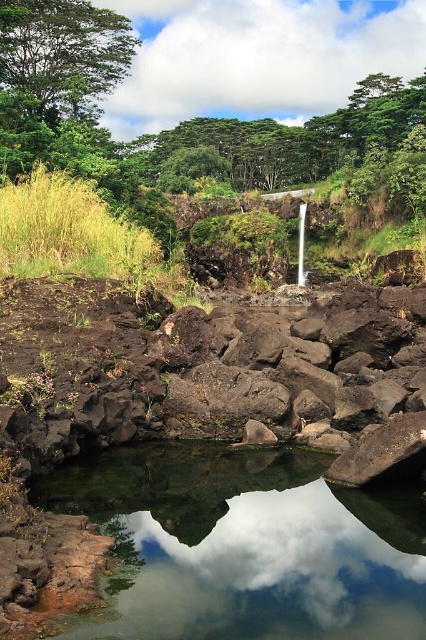
Question: Can you confirm if clear water at center is positioned below green leafy tree at upper left?

Choices:
 (A) yes
 (B) no

Answer: (A)

Question: Is clear water at center to the right of green leafy tree at upper left from the viewer's perspective?

Choices:
 (A) yes
 (B) no

Answer: (A)

Question: Can you confirm if clear water at center is positioned above green leafy tree at upper left?

Choices:
 (A) no
 (B) yes

Answer: (A)

Question: Which of the following is the farthest from the observer?

Choices:
 (A) (264, 496)
 (B) (69, 68)

Answer: (B)

Question: Among these points, which one is farthest from the camera?

Choices:
 (A) (172, 579)
 (B) (88, 60)

Answer: (B)

Question: Which point is farther to the camera?

Choices:
 (A) green leafy tree at upper left
 (B) clear water at center

Answer: (A)